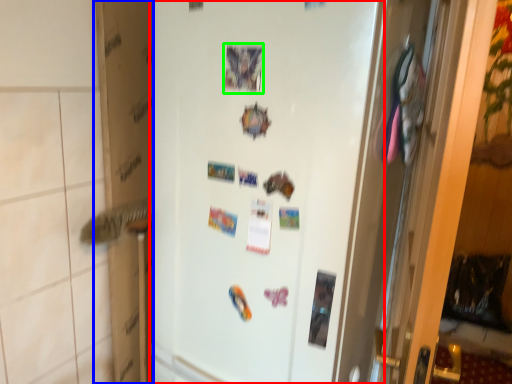
Question: Considering the real-world distances, which object is farthest from refrigerator (highlighted by a red box)? cardboard box (highlighted by a blue box) or postcard (highlighted by a green box)?

Choices:
 (A) cardboard box
 (B) postcard

Answer: (A)